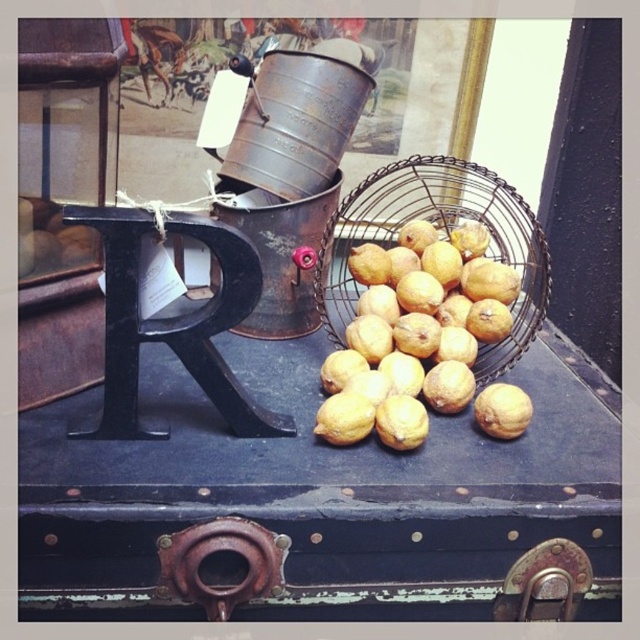
You are standing in front of a rustic display. There is a dark blue weathered trunk at center and a small cylindrical metal bucket with a handle to its left. A black metal letter R sits on top of the trunk. A point at coordinate (320, 497) is marked. Which object is located at that coordinate?

The point at coordinate (320, 497) marks the rusty metal trunk at center.

You are setting up a display and need to place the metallic wire basket at center on top of the rusty metal trunk at center. Is this possible based on their current positions?

The rusty metal trunk at center is positioned under the metallic wire basket at center, so yes, placing the metallic wire basket at center on top of the rusty metal trunk at center is possible.